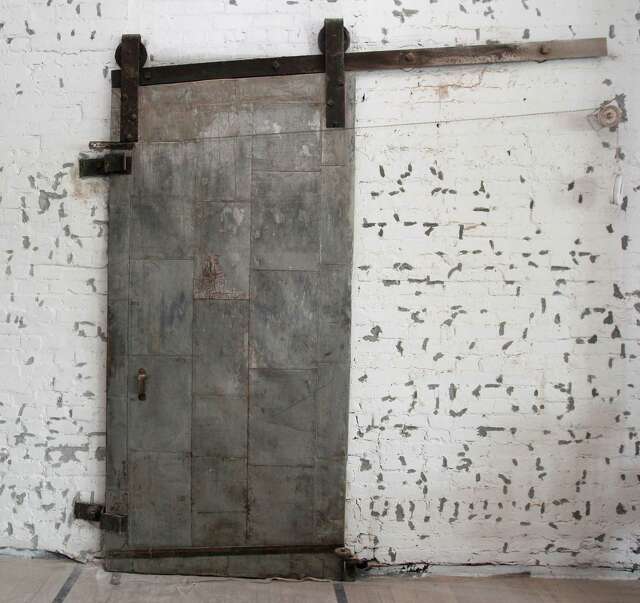
The height and width of the screenshot is (603, 640). I want to click on grey floor, so click(x=41, y=581), click(x=173, y=592), click(x=376, y=592), click(x=546, y=586).